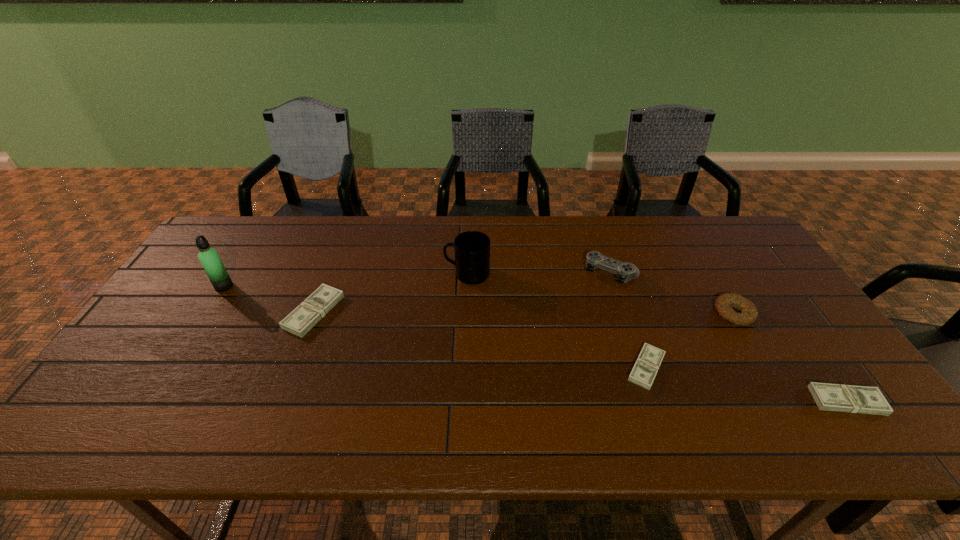
Where is `vacant area that lies between the leftmost object and the rightmost object`? The width and height of the screenshot is (960, 540). vacant area that lies between the leftmost object and the rightmost object is located at coordinates (536, 343).

Locate an element on the screen. free spot between the tallest object and the leftmost money is located at coordinates (269, 299).

The height and width of the screenshot is (540, 960). Find the location of `empty space between the leftmost object and the rightmost money`. empty space between the leftmost object and the rightmost money is located at coordinates (536, 343).

Choose which object is the nearest neighbor to the tallest object. Please provide its 2D coordinates. Your answer should be formatted as a tuple, i.e. [(x, y)], where the tuple contains the x and y coordinates of a point satisfying the conditions above.

[(304, 317)]

Locate which object ranks sixth in proximity to the fourth shortest object. Please provide its 2D coordinates. Your answer should be formatted as a tuple, i.e. [(x, y)], where the tuple contains the x and y coordinates of a point satisfying the conditions above.

[(209, 257)]

The width and height of the screenshot is (960, 540). In order to click on money that is the second closest one to the second money from right to left in this screenshot , I will do pos(304,317).

Find the location of a particular element. money that can be found as the second closest to the second shortest object is located at coordinates (304, 317).

Find the location of a particular element. This screenshot has width=960, height=540. free location that satisfies the following two spatial constraints: 1. on the front side of the farthest money; 2. on the right side of the rightmost money is located at coordinates (280, 401).

Identify the location of vacant space that satisfies the following two spatial constraints: 1. on the side of the third object from left to right with the handle; 2. on the right side of the second money from right to left. (465, 368).

You are a GUI agent. You are given a task and a screenshot of the screen. Output one action in this format:
    pyautogui.click(x=<x>, y=<y>)
    Task: Click on the vacant area that satisfies the following two spatial constraints: 1. on the front side of the control; 2. on the side of the mug with the handle
    This screenshot has width=960, height=540.
    Given the screenshot: What is the action you would take?
    pyautogui.click(x=612, y=274)